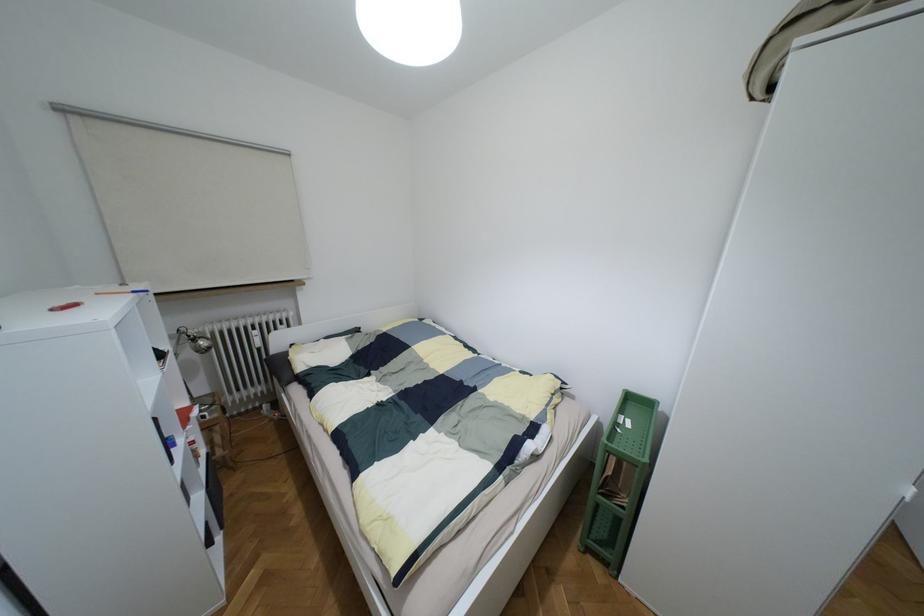
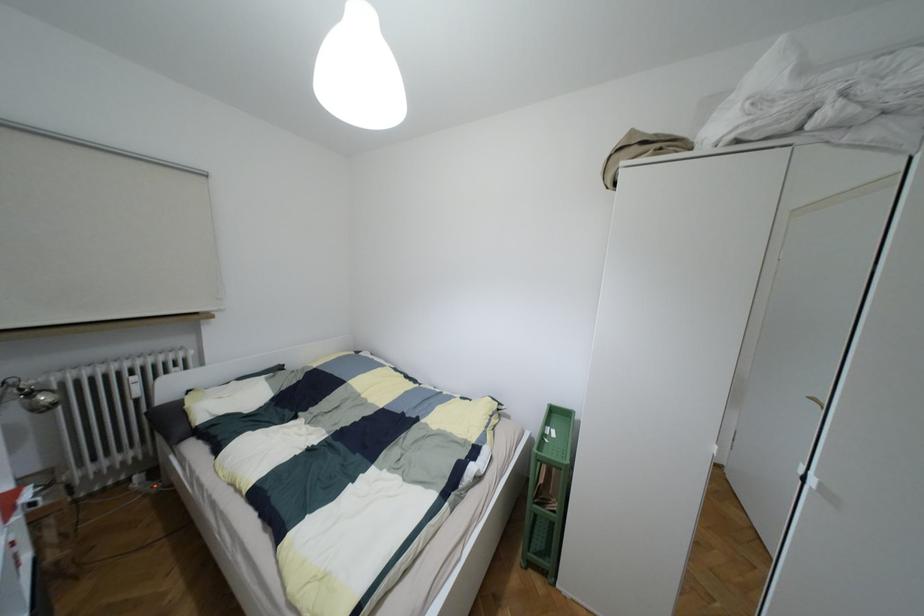
Where in the second image is the point corresponding to point 201,342 from the first image?

(43, 397)